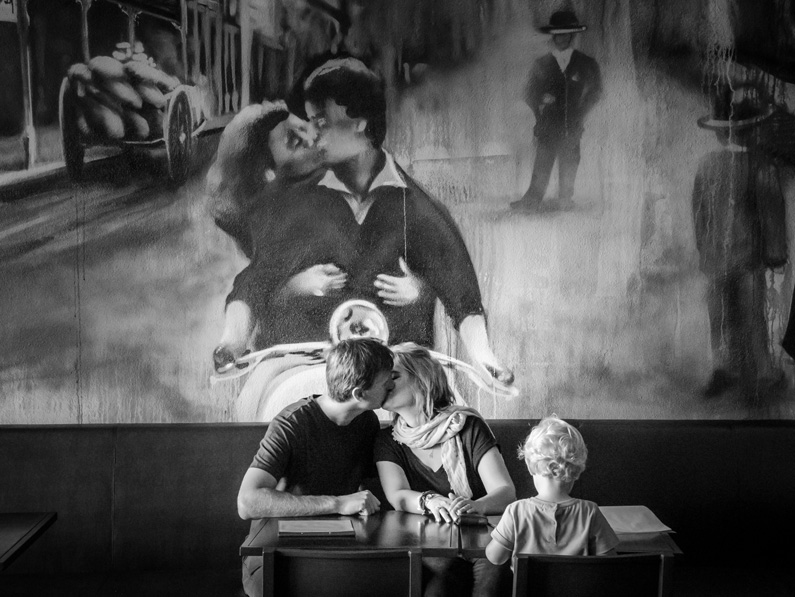
The width and height of the screenshot is (795, 597). In order to click on painting animation on eatery wall in this screenshot , I will do `click(17, 304)`.